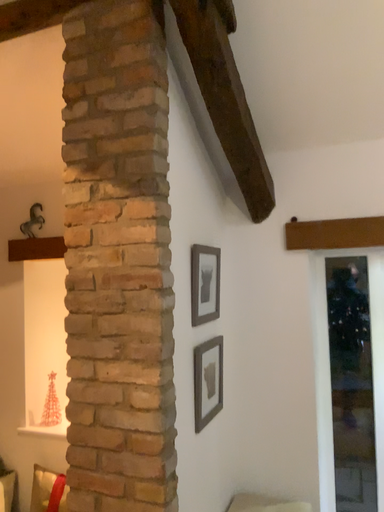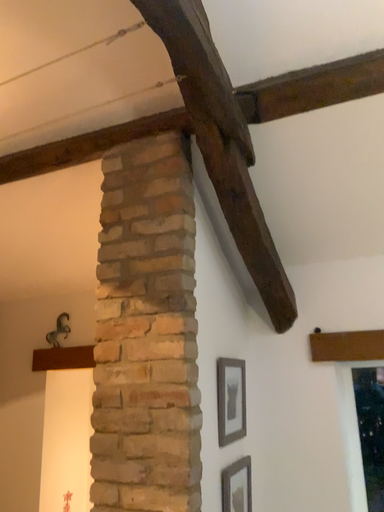
Question: How did the camera likely rotate when shooting the video?

Choices:
 (A) rotated downward
 (B) rotated upward

Answer: (B)